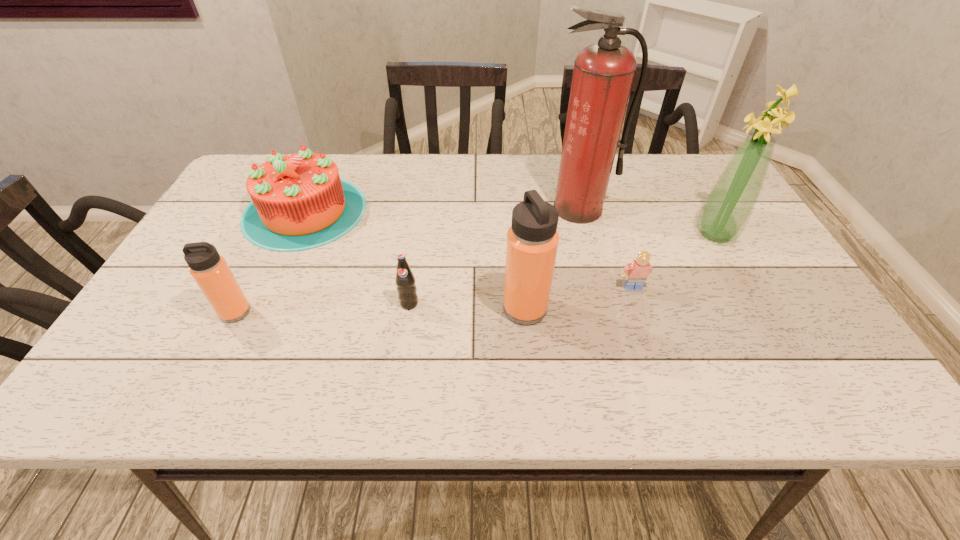
Select which object is the second closest to the taller thermos bottle. Please provide its 2D coordinates. Your answer should be formatted as a tuple, i.e. [(x, y)], where the tuple contains the x and y coordinates of a point satisfying the conditions above.

[(407, 291)]